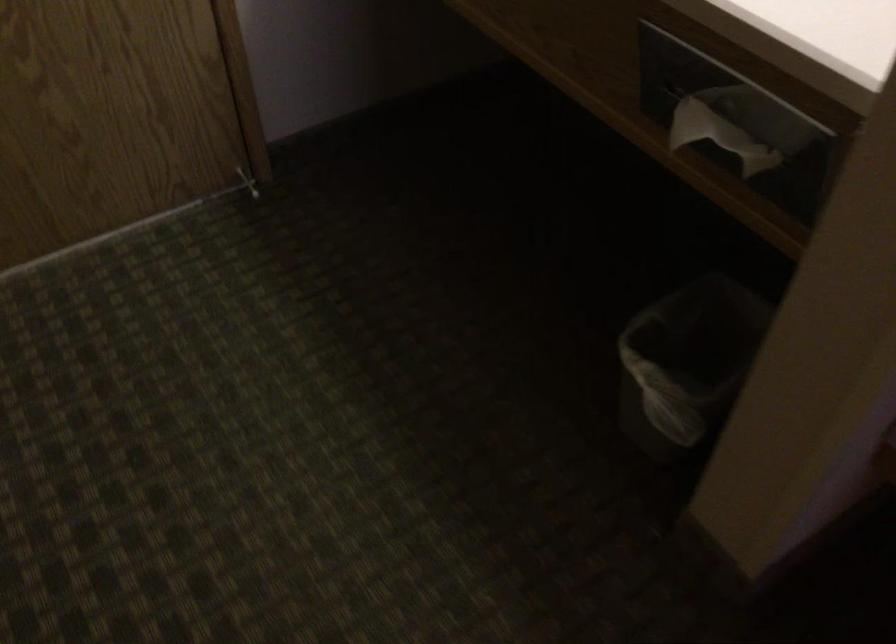
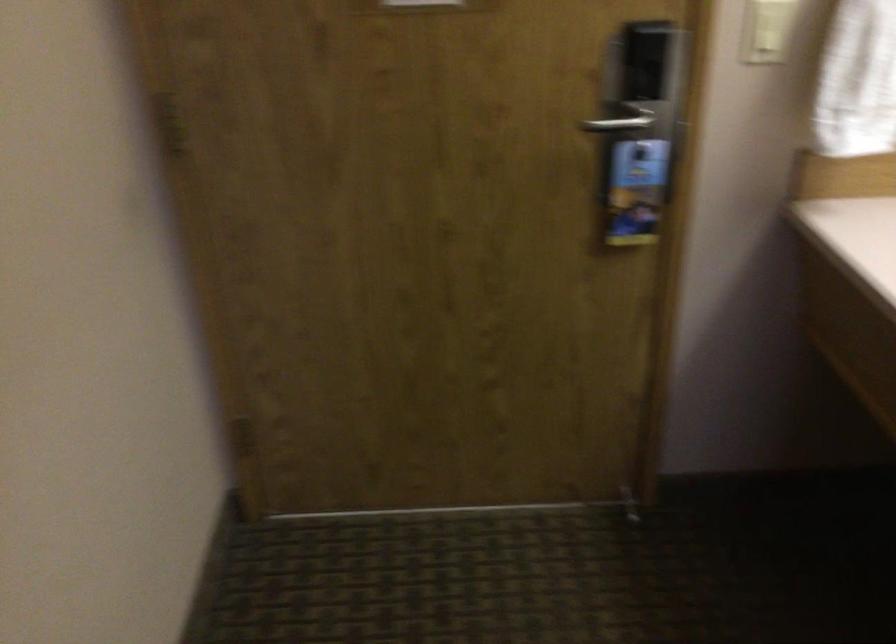
Question: The first image is from the beginning of the video and the second image is from the end. How did the camera likely rotate when shooting the video?

Choices:
 (A) Left
 (B) Right
 (C) Up
 (D) Down

Answer: (A)